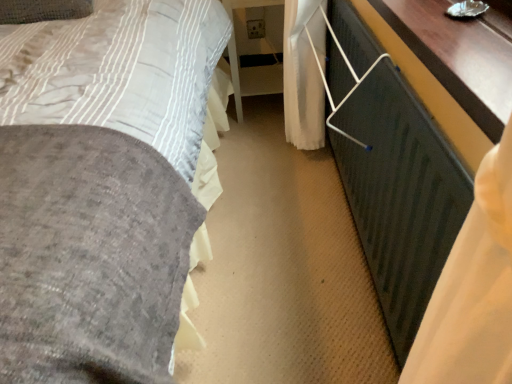
The width and height of the screenshot is (512, 384). I want to click on free space in front of white glossy table at center, the second table in the right-to-left sequence, so click(254, 140).